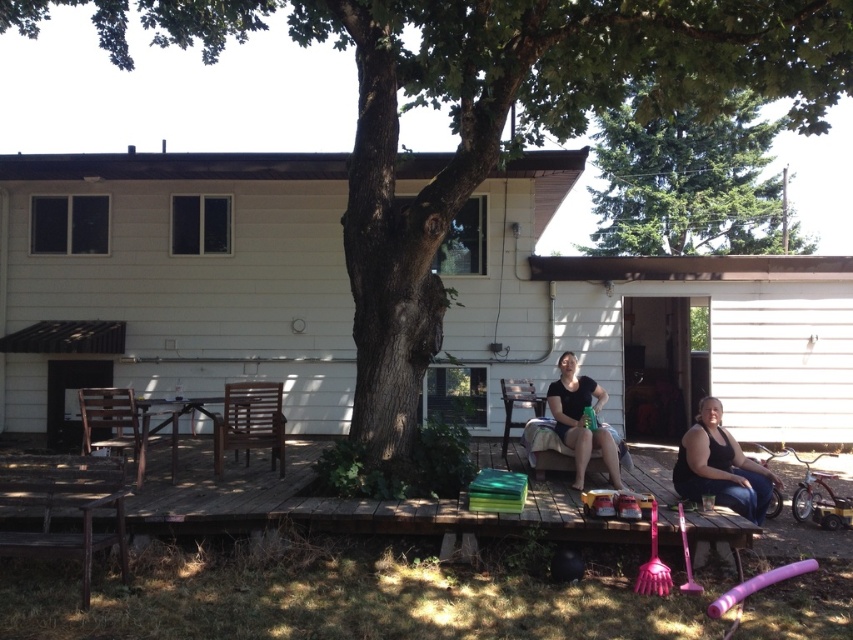
You are planning to set up a small tent between the black fabric woman at lower right and the matte black shirt at center. Considering their heights, which object should the tent be placed closer to?

The black fabric woman at lower right is not as tall as the matte black shirt at center, so the tent should be placed closer to the black fabric woman at lower right to ensure it is visible over the shorter object.

You are planning to set up a small garden in your backyard. You see the green leafy tree at upper center and the black fabric woman at lower right. Which object would you consider as the larger one for space planning purposes?

The green leafy tree at upper center is bigger than the black fabric woman at lower right, so it would be the larger object to consider for space planning purposes.